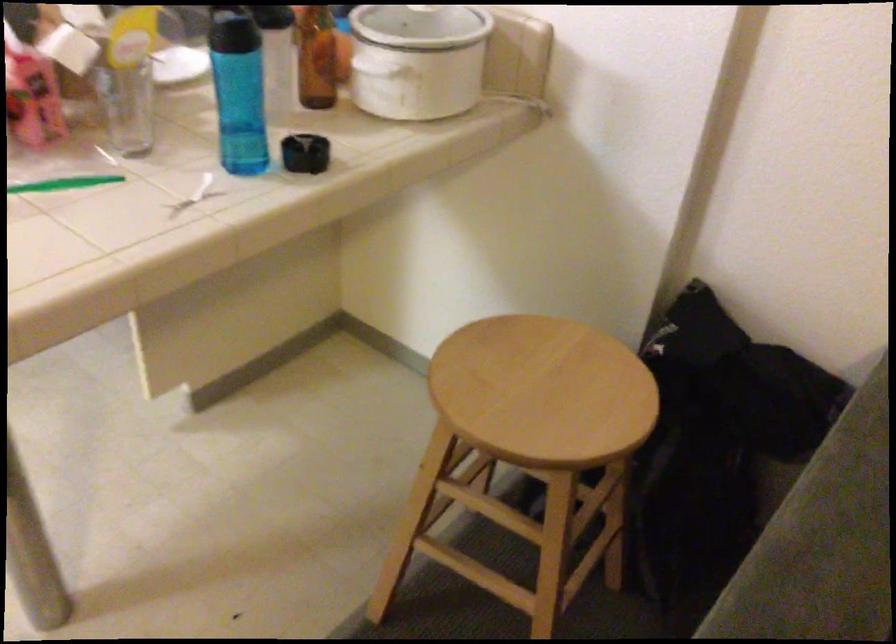
The width and height of the screenshot is (896, 644). What do you see at coordinates (418, 60) in the screenshot? I see `a white pot handle` at bounding box center [418, 60].